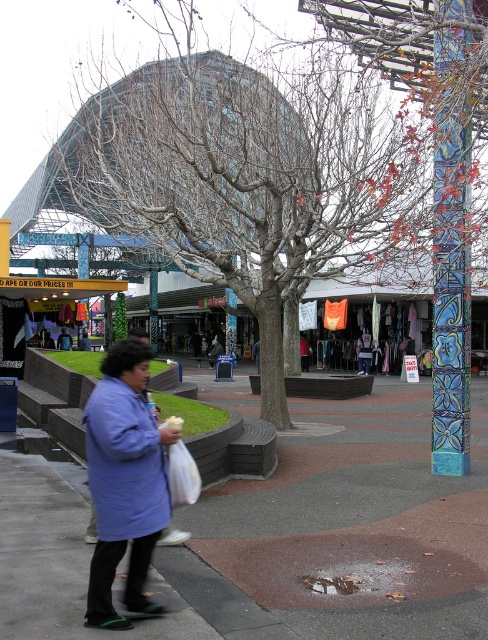
You are standing in the shopping area and see the concrete sidewalk at center and the dark blue shirt at center. Which object is located to the right of the other?

The concrete sidewalk at center is positioned on the right side of dark blue shirt at center, so the concrete sidewalk at center is to the right of the dark blue shirt at center.

You are standing in the plaza and want to hide behind the bare wood tree at center to avoid being seen by someone wearing the dark blue shirt at center. Is this possible?

The bare wood tree at center is located above the dark blue shirt at center, so hiding behind the tree would place you above the person, making it possible to avoid detection.

Based on the photo, you are a fashion designer observing a person in the scene. The person is wearing a blue fabric coat at lower left and a dark blue shirt at center. Which clothing item is positioned to the right of the other?

The blue fabric coat at lower left is positioned on the right side of dark blue shirt at center.